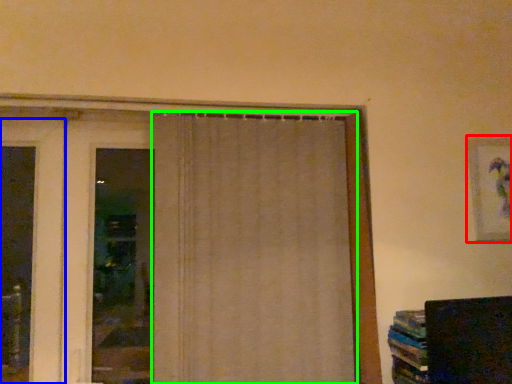
Question: Estimate the real-world distances between objects in this image. Which object is farther from picture frame (highlighted by a red box), door (highlighted by a blue box) or curtain (highlighted by a green box)?

Choices:
 (A) door
 (B) curtain

Answer: (A)